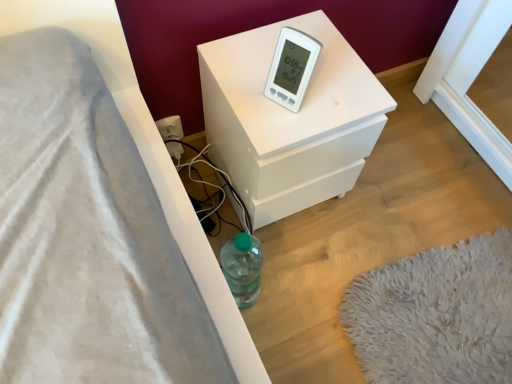
Locate an element on the screen. free space to the back side of white plastic thermometer at upper center is located at coordinates pyautogui.click(x=274, y=50).